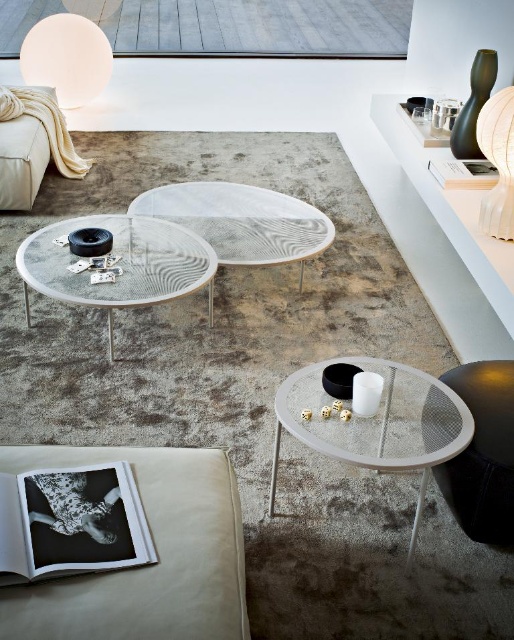
Question: Which point is closer to the camera taking this photo?

Choices:
 (A) (206, 541)
 (B) (421, 416)
 (C) (498, 396)

Answer: (A)

Question: Which object is positioned farthest from the white paper lampshade at upper right?

Choices:
 (A) black mesh stool at lower right
 (B) beige leather couch at lower left
 (C) clear glass table at center

Answer: (B)

Question: Is the position of beige leather couch at lower left more distant than that of white paper lampshade at upper right?

Choices:
 (A) no
 (B) yes

Answer: (A)

Question: Does beige leather couch at lower left have a larger size compared to white marble side table at center?

Choices:
 (A) no
 (B) yes

Answer: (A)

Question: Which point appears closest to the camera in this image?

Choices:
 (A) (149, 214)
 (B) (206, 636)
 (C) (74, 298)

Answer: (B)

Question: Does white marble side table at center appear on the left side of black mesh stool at lower right?

Choices:
 (A) no
 (B) yes

Answer: (B)